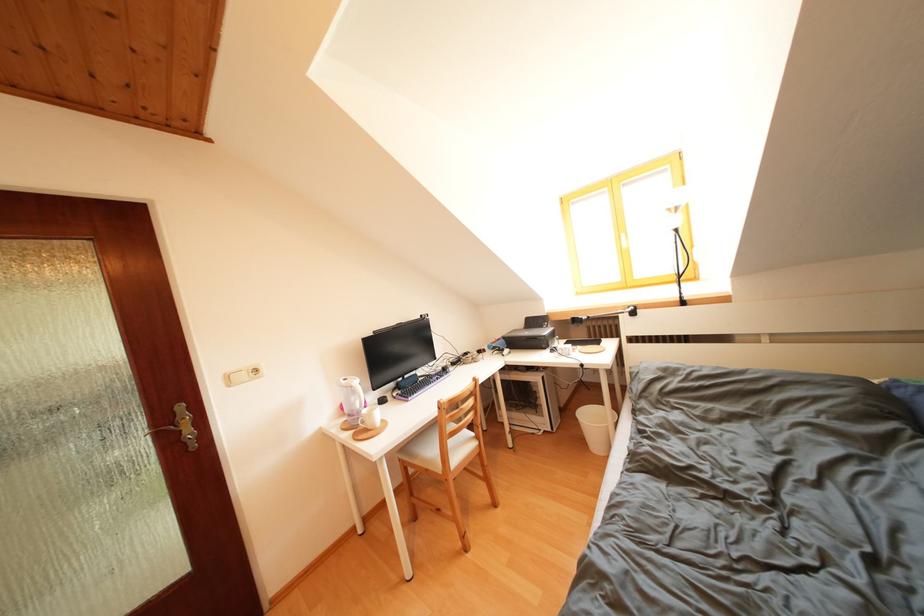
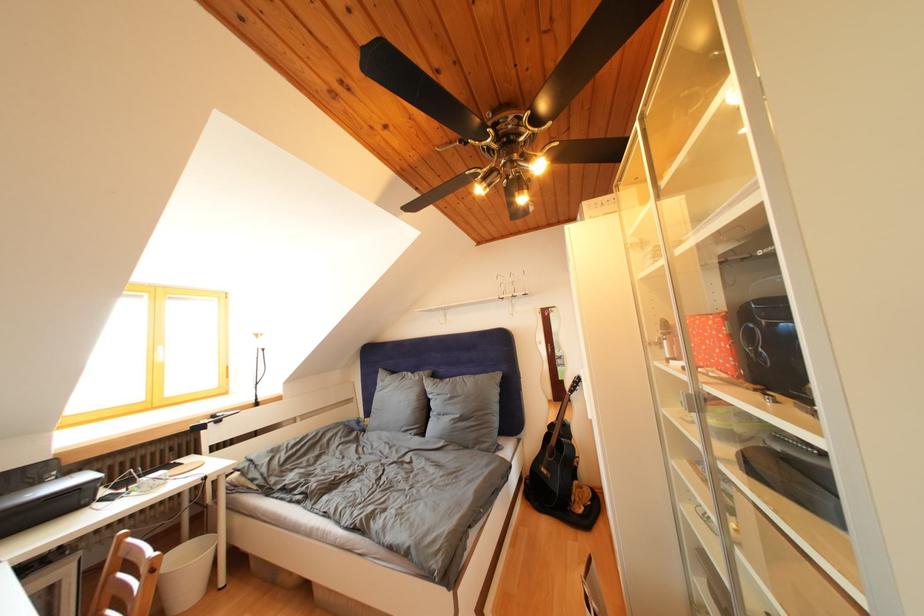
In the second image, find the point that corresponds to point (549, 331) in the first image.

(44, 488)